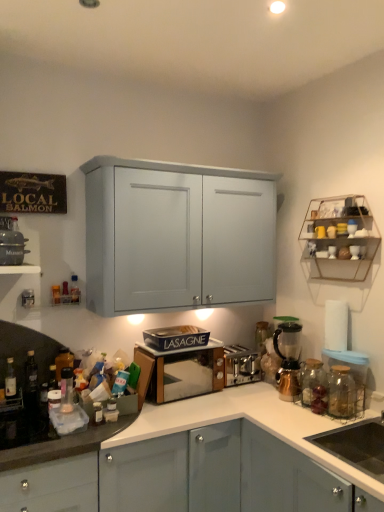
Locate an element on the screen. This screenshot has height=512, width=384. free space in front of translucent plastic bottle at lower left, the fifth bottle in the left-to-right sequence is located at coordinates (62, 422).